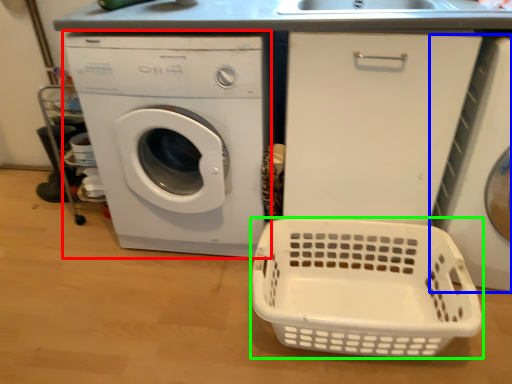
Question: Which object is the closest to the washing machine (highlighted by a red box)? Choose among these: washing machine (highlighted by a blue box) or basket (highlighted by a green box).

Choices:
 (A) washing machine
 (B) basket

Answer: (B)